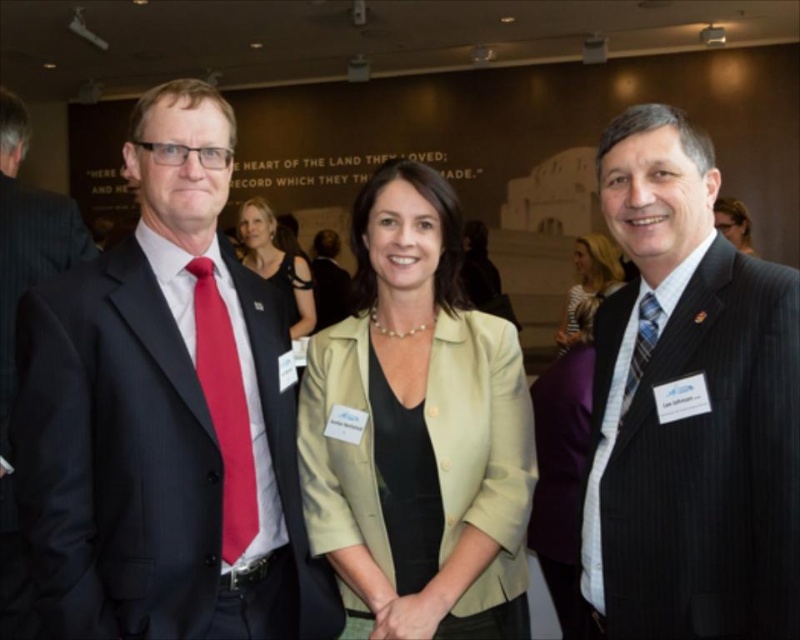
You are a photographer at a formal event and need to adjust the lighting to ensure both the dark blue suit at left and the matte black blazer at center are well lit. Given their positions, which one might require more direct lighting to avoid appearing too dark in the photo?

The dark blue suit at left is located below matte black blazer at center. Since it is positioned lower, it might be in a shadowed area and thus require more direct lighting to ensure it doesn not appear too dark compared to the matte black blazer at center.

You are a photographer adjusting the camera settings to ensure all subjects are in focus. The camera has a depth of field that can cover a distance of 5 feet. Given the distance between the dark blue suit at left and the blue striped tie at right, will the depth of field be sufficient to keep both in focus?

The dark blue suit at left is 5.72 feet away from the blue striped tie at right. Since the depth of field covers 5 feet, which is less than the distance between them, the depth of field will not be sufficient to keep both in focus.

You are standing in front of the image and want to locate the dark blue suit at left. Where exactly is it positioned in terms of coordinates?

The dark blue suit at left is positioned at coordinates point [14,324].